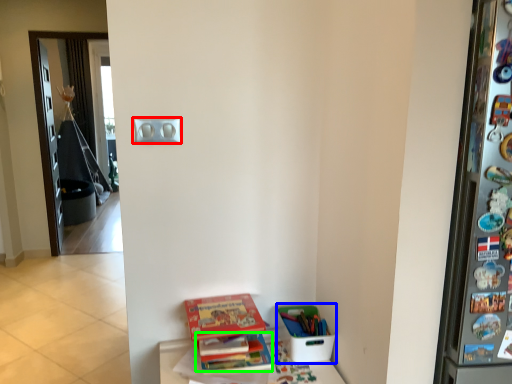
Question: Based on their relative distances, which object is nearer to light switch (highlighted by a red box)? Choose from box (highlighted by a blue box) and book (highlighted by a green box).

Choices:
 (A) box
 (B) book

Answer: (B)